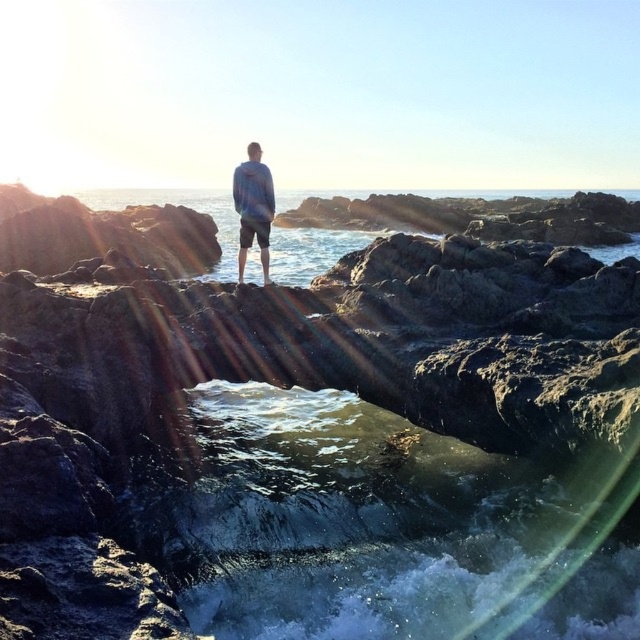
Does rough textured rock at center appear over blue cotton hoodie at center?

Actually, rough textured rock at center is below blue cotton hoodie at center.

Does rough textured rock at center have a greater width compared to blue cotton hoodie at center?

Correct, the width of rough textured rock at center exceeds that of blue cotton hoodie at center.

Does point (496, 337) lie behind point (243, 184)?

No, it is not.

Locate an element on the screen. rough textured rock at center is located at coordinates (262, 474).